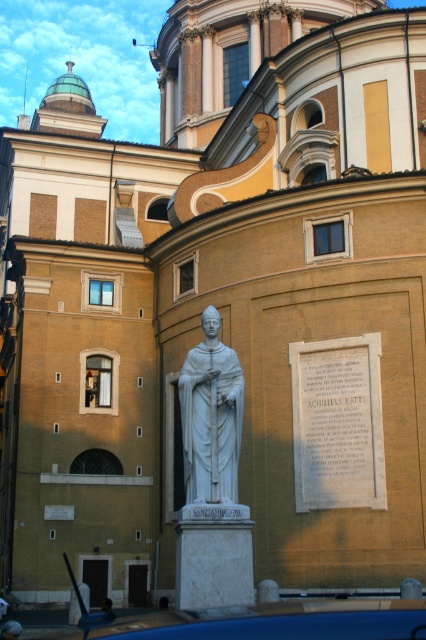
Question: Which of the following is the farthest from the observer?

Choices:
 (A) (264, 616)
 (B) (232, 477)

Answer: (B)

Question: Among these objects, which one is nearest to the camera?

Choices:
 (A) blue matte car at lower center
 (B) white marble statue at center

Answer: (A)

Question: Is blue matte car at lower center to the left of white marble statue at center from the viewer's perspective?

Choices:
 (A) no
 (B) yes

Answer: (A)

Question: Which point is closer to the camera?

Choices:
 (A) blue matte car at lower center
 (B) white marble statue at center

Answer: (A)

Question: Does blue matte car at lower center appear under white marble statue at center?

Choices:
 (A) yes
 (B) no

Answer: (A)

Question: Where is blue matte car at lower center located in relation to white marble statue at center in the image?

Choices:
 (A) left
 (B) right

Answer: (B)